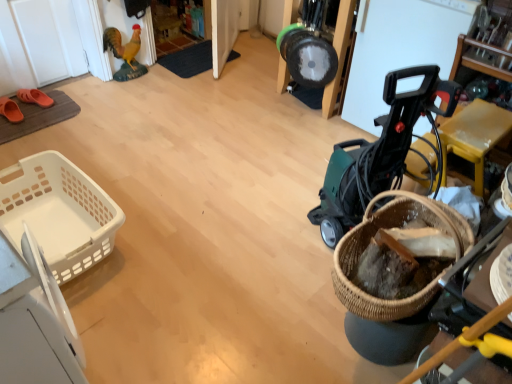
Find the location of a particular element. The height and width of the screenshot is (384, 512). vacant area that lies between green plastic baby carriage at right and white plastic basket at left, placed as the 1th basket when sorted from left to right is located at coordinates (211, 238).